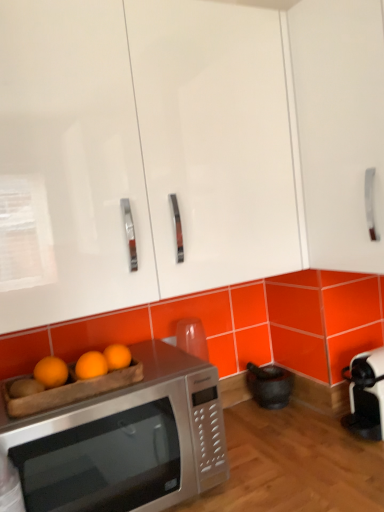
Image resolution: width=384 pixels, height=512 pixels. What do you see at coordinates (42, 379) in the screenshot?
I see `orange matte wood tray at lower left` at bounding box center [42, 379].

Measure the distance between orange matte wood tray at lower left and camera.

orange matte wood tray at lower left is 86.20 centimeters from camera.

Locate an element on the screen. satin silver microwave at lower left is located at coordinates (125, 441).

The image size is (384, 512). What do you see at coordinates (125, 441) in the screenshot?
I see `satin silver microwave at lower left` at bounding box center [125, 441].

Identify the location of orange matte wood tray at lower left. (42, 379).

In terms of size, does white glossy cabinet at upper right, which appears as the second cabinetry when viewed from the left, appear bigger or smaller than white glossy cabinet at upper center, which is counted as the 1th cabinetry, starting from the left?

Considering their sizes, white glossy cabinet at upper right, which appears as the second cabinetry when viewed from the left, takes up less space than white glossy cabinet at upper center, which is counted as the 1th cabinetry, starting from the left.

From the image's perspective, between white glossy cabinet at upper right, which appears as the second cabinetry when viewed from the left, and white glossy cabinet at upper center, which is the 2th cabinetry from right to left, who is located below?

white glossy cabinet at upper center, which is the 2th cabinetry from right to left, appears lower in the image.

This screenshot has height=512, width=384. Find the location of `cabinetry located in front of the white glossy cabinet at upper right, which appears as the second cabinetry when viewed from the left`. cabinetry located in front of the white glossy cabinet at upper right, which appears as the second cabinetry when viewed from the left is located at coordinates (184, 147).

Is there a large distance between white glossy cabinet at upper right, which appears as the second cabinetry when viewed from the left, and orange matte wood tray at lower left?

They are positioned close to each other.

Considering the relative sizes of white glossy cabinet at upper right, which appears as the second cabinetry when viewed from the left, and orange matte wood tray at lower left in the image provided, is white glossy cabinet at upper right, which appears as the second cabinetry when viewed from the left, smaller than orange matte wood tray at lower left?

Actually, white glossy cabinet at upper right, which appears as the second cabinetry when viewed from the left, might be larger than orange matte wood tray at lower left.

Is orange matte wood tray at lower left surrounded by white glossy cabinet at upper right, which appears as the second cabinetry when viewed from the left?

That's incorrect, orange matte wood tray at lower left is not inside white glossy cabinet at upper right, which appears as the second cabinetry when viewed from the left.

What are the coordinates of `cabinetry lying behind the orange matte wood tray at lower left` in the screenshot? It's located at (338, 128).

Considering the relative sizes of satin silver microwave at lower left and white glossy cabinet at upper right, placed as the 1th cabinetry when sorted from right to left, in the image provided, is satin silver microwave at lower left thinner than white glossy cabinet at upper right, placed as the 1th cabinetry when sorted from right to left,?

No.

Looking at this image, from the image's perspective, is satin silver microwave at lower left above or below white glossy cabinet at upper right, which appears as the second cabinetry when viewed from the left?

Based on their image positions, satin silver microwave at lower left is located beneath white glossy cabinet at upper right, which appears as the second cabinetry when viewed from the left.

Does satin silver microwave at lower left have a lesser height compared to white glossy cabinet at upper right, placed as the 1th cabinetry when sorted from right to left?

Correct, satin silver microwave at lower left is not as tall as white glossy cabinet at upper right, placed as the 1th cabinetry when sorted from right to left.

Considering the sizes of objects satin silver microwave at lower left and white glossy cabinet at upper right, placed as the 1th cabinetry when sorted from right to left, in the image provided, who is bigger, satin silver microwave at lower left or white glossy cabinet at upper right, placed as the 1th cabinetry when sorted from right to left,?

Bigger between the two is white glossy cabinet at upper right, placed as the 1th cabinetry when sorted from right to left.

Is orange matte wood tray at lower left in contact with white glossy cabinet at upper right, which appears as the second cabinetry when viewed from the left?

They are not placed beside each other.

Find the location of a particular element. The width and height of the screenshot is (384, 512). cabinetry that appears behind the orange matte wood tray at lower left is located at coordinates (338, 128).

How distant is orange matte wood tray at lower left from white glossy cabinet at upper right, placed as the 1th cabinetry when sorted from right to left?

29.92 inches.

Which of these two, white glossy cabinet at upper center, which is the 2th cabinetry from right to left, or white glossy cabinet at upper right, which appears as the second cabinetry when viewed from the left, is thinner?

With smaller width is white glossy cabinet at upper right, which appears as the second cabinetry when viewed from the left.

Based on the photo, from a real-world perspective, which object stands above the other?

white glossy cabinet at upper center, which is the 2th cabinetry from right to left, from a real-world perspective.

Can you see white glossy cabinet at upper center, which is counted as the 1th cabinetry, starting from the left, touching white glossy cabinet at upper right, placed as the 1th cabinetry when sorted from right to left?

They are not placed beside each other.

Where is `cabinetry above the white glossy cabinet at upper center, which is the 2th cabinetry from right to left (from the image's perspective)`? cabinetry above the white glossy cabinet at upper center, which is the 2th cabinetry from right to left (from the image's perspective) is located at coordinates (338, 128).

Which is farther from the camera, (198, 81) or (34, 452)?

The point (198, 81) is behind.

Which object is closer to the camera taking this photo, white glossy cabinet at upper center, which is the 2th cabinetry from right to left, or satin silver microwave at lower left?

white glossy cabinet at upper center, which is the 2th cabinetry from right to left, is closer to the camera.

Where is `microwave oven behind the white glossy cabinet at upper center, which is counted as the 1th cabinetry, starting from the left`? Image resolution: width=384 pixels, height=512 pixels. microwave oven behind the white glossy cabinet at upper center, which is counted as the 1th cabinetry, starting from the left is located at coordinates (125, 441).

Based on their sizes in the image, would you say satin silver microwave at lower left is bigger or smaller than white glossy cabinet at upper center, which is counted as the 1th cabinetry, starting from the left?

Considering their sizes, satin silver microwave at lower left takes up less space than white glossy cabinet at upper center, which is counted as the 1th cabinetry, starting from the left.

In the image, is satin silver microwave at lower left positioned in front of or behind white glossy cabinet at upper center, which is counted as the 1th cabinetry, starting from the left?

Clearly, satin silver microwave at lower left is behind white glossy cabinet at upper center, which is counted as the 1th cabinetry, starting from the left.

Between satin silver microwave at lower left and white glossy cabinet at upper center, which is counted as the 1th cabinetry, starting from the left, which one appears on the right side from the viewer's perspective?

white glossy cabinet at upper center, which is counted as the 1th cabinetry, starting from the left.

Locate an element on the screen. Image resolution: width=384 pixels, height=512 pixels. cabinetry that is above the white glossy cabinet at upper center, which is the 2th cabinetry from right to left (from the image's perspective) is located at coordinates (338, 128).

Where is `fruit that is on the left side of white glossy cabinet at upper right, which appears as the second cabinetry when viewed from the left`? Image resolution: width=384 pixels, height=512 pixels. fruit that is on the left side of white glossy cabinet at upper right, which appears as the second cabinetry when viewed from the left is located at coordinates (42, 379).

Looking at the image, which one is located closer to white glossy cabinet at upper right, which appears as the second cabinetry when viewed from the left, satin silver microwave at lower left or orange matte wood tray at lower left?

satin silver microwave at lower left.

Which object lies further to the anchor point satin silver microwave at lower left, white glossy cabinet at upper center, which is counted as the 1th cabinetry, starting from the left, or white glossy cabinet at upper right, placed as the 1th cabinetry when sorted from right to left?

white glossy cabinet at upper right, placed as the 1th cabinetry when sorted from right to left, lies further to satin silver microwave at lower left than the other object.

From the image, which object appears to be farther from orange matte wood tray at lower left, satin silver microwave at lower left or white glossy cabinet at upper right, placed as the 1th cabinetry when sorted from right to left?

white glossy cabinet at upper right, placed as the 1th cabinetry when sorted from right to left, is further to orange matte wood tray at lower left.

In the scene shown: Based on their spatial positions, is white glossy cabinet at upper center, which is the 2th cabinetry from right to left, or orange matte wood tray at lower left further from white glossy cabinet at upper right, which appears as the second cabinetry when viewed from the left?

orange matte wood tray at lower left is positioned further to the anchor white glossy cabinet at upper right, which appears as the second cabinetry when viewed from the left.

Considering their positions, is orange matte wood tray at lower left positioned closer to satin silver microwave at lower left than white glossy cabinet at upper right, placed as the 1th cabinetry when sorted from right to left?

The object closer to satin silver microwave at lower left is orange matte wood tray at lower left.

Looking at the image, which one is located further to orange matte wood tray at lower left, white glossy cabinet at upper right, which appears as the second cabinetry when viewed from the left, or satin silver microwave at lower left?

Based on the image, white glossy cabinet at upper right, which appears as the second cabinetry when viewed from the left, appears to be further to orange matte wood tray at lower left.

Based on their spatial positions, is orange matte wood tray at lower left or white glossy cabinet at upper right, which appears as the second cabinetry when viewed from the left, closer to white glossy cabinet at upper center, which is counted as the 1th cabinetry, starting from the left?

white glossy cabinet at upper right, which appears as the second cabinetry when viewed from the left.

From the image, which object appears to be farther from white glossy cabinet at upper center, which is counted as the 1th cabinetry, starting from the left, satin silver microwave at lower left or orange matte wood tray at lower left?

orange matte wood tray at lower left is further to white glossy cabinet at upper center, which is counted as the 1th cabinetry, starting from the left.

This screenshot has height=512, width=384. What are the coordinates of `microwave oven between orange matte wood tray at lower left and white glossy cabinet at upper right, which appears as the second cabinetry when viewed from the left, in the horizontal direction` in the screenshot? It's located at coord(125,441).

Find the location of a particular element. The image size is (384, 512). cabinetry between white glossy cabinet at upper right, which appears as the second cabinetry when viewed from the left, and satin silver microwave at lower left from top to bottom is located at coordinates (184, 147).

The image size is (384, 512). What are the coordinates of `fruit between white glossy cabinet at upper center, which is counted as the 1th cabinetry, starting from the left, and satin silver microwave at lower left, in the vertical direction` in the screenshot? It's located at pos(42,379).

The image size is (384, 512). Find the location of `cabinetry situated between orange matte wood tray at lower left and white glossy cabinet at upper right, which appears as the second cabinetry when viewed from the left, from left to right`. cabinetry situated between orange matte wood tray at lower left and white glossy cabinet at upper right, which appears as the second cabinetry when viewed from the left, from left to right is located at coordinates (184, 147).